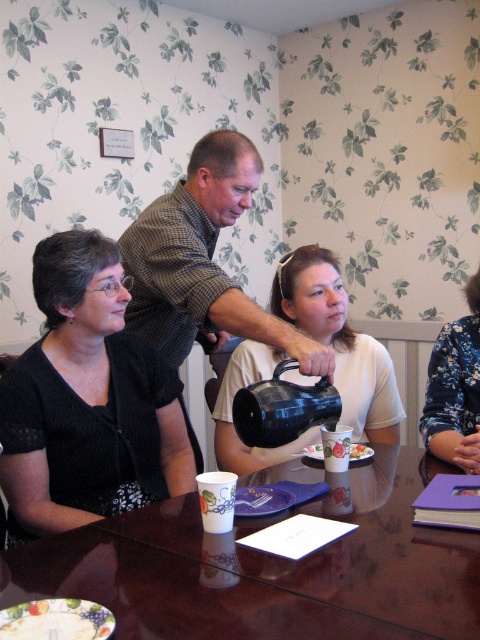
Is blue floral blouse at upper right smaller than black matte teapot at center?

Incorrect, blue floral blouse at upper right is not smaller in size than black matte teapot at center.

Who is positioned more to the left, blue floral blouse at upper right or black matte teapot at center?

black matte teapot at center is more to the left.

What are the coordinates of `blue floral blouse at upper right` in the screenshot? It's located at (455, 388).

Who is taller, matte black sweater at left or blue floral blouse at upper right?

Standing taller between the two is matte black sweater at left.

Is point (4, 376) positioned behind point (468, 420)?

No.

Describe the element at coordinates (86, 401) in the screenshot. Image resolution: width=480 pixels, height=640 pixels. I see `matte black sweater at left` at that location.

Find the location of `matte black sweater at left`. matte black sweater at left is located at coordinates (86, 401).

Who is higher up, matte black teapot at center or blue floral blouse at upper right?

matte black teapot at center is above.

Is point (320, 336) behind point (452, 353)?

Yes, it is behind point (452, 353).

Find the location of a particular element. This screenshot has width=480, height=640. matte black teapot at center is located at coordinates click(x=339, y=340).